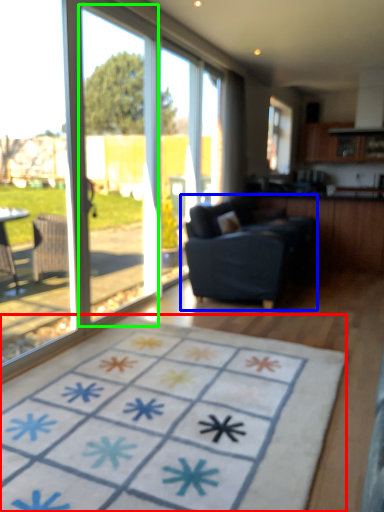
Question: Considering the real-world distances, which object is closest to doormat (highlighted by a red box)? studio couch (highlighted by a blue box) or screen door (highlighted by a green box).

Choices:
 (A) studio couch
 (B) screen door

Answer: (A)